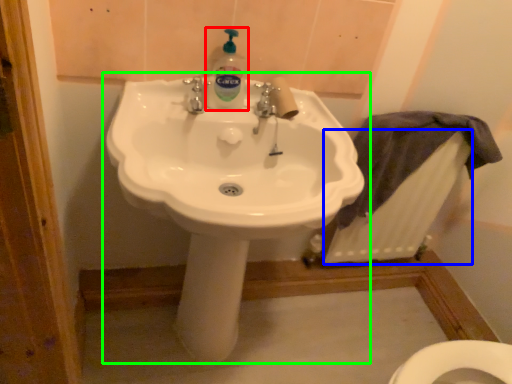
Question: Which object is positioned farthest from cleaning product (highlighted by a red box)? Select from radiator (highlighted by a blue box) and sink (highlighted by a green box).

Choices:
 (A) radiator
 (B) sink

Answer: (A)